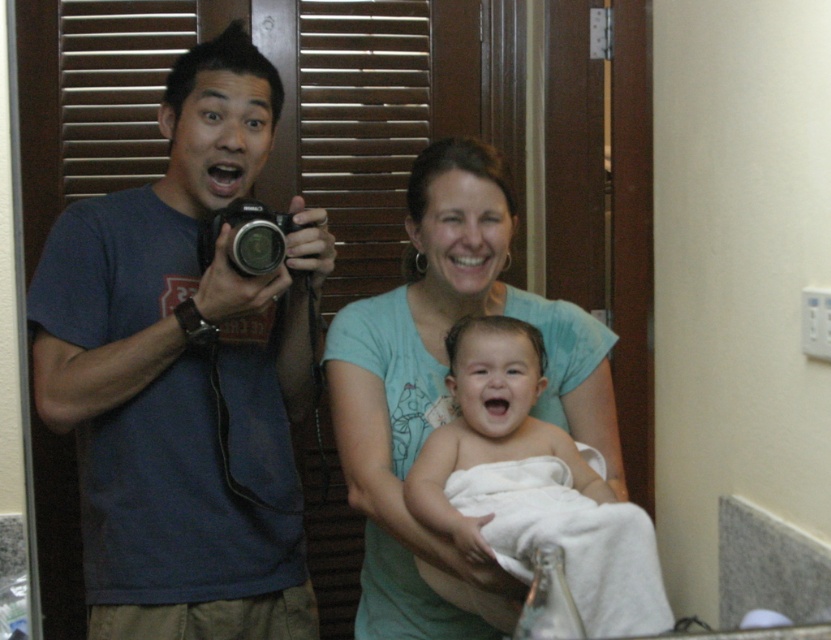
Question: Where is light blue t-shirt at center located in relation to white soft towel at center in the image?

Choices:
 (A) above
 (B) below

Answer: (A)

Question: Observing the image, what is the correct spatial positioning of blue cotton t-shirt at left in reference to black plastic camera at left?

Choices:
 (A) left
 (B) right

Answer: (A)

Question: Which point is closer to the camera?

Choices:
 (A) (235, 248)
 (B) (470, 312)
 (C) (220, 532)

Answer: (A)

Question: Which point is closer to the camera taking this photo?

Choices:
 (A) (210, 232)
 (B) (507, 605)

Answer: (B)

Question: Is light blue t-shirt at center thinner than white soft towel at center?

Choices:
 (A) yes
 (B) no

Answer: (B)

Question: Which object appears closest to the camera in this image?

Choices:
 (A) black plastic camera at left
 (B) blue cotton t-shirt at left
 (C) light blue t-shirt at center

Answer: (C)